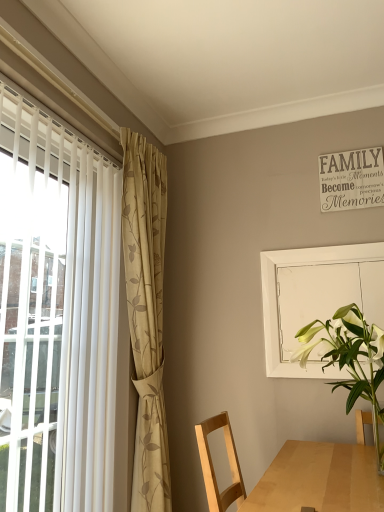
Question: From a real-world perspective, is beige floral fabric curtain at left positioned above or below white glossy vase at lower right?

Choices:
 (A) above
 (B) below

Answer: (A)

Question: Is beige floral fabric curtain at left in front of or behind white glossy vase at lower right in the image?

Choices:
 (A) behind
 (B) front

Answer: (A)

Question: Which object is positioned closest to the beige floral fabric curtain at left?

Choices:
 (A) white glossy vase at lower right
 (B) white matte screen door at upper right

Answer: (B)

Question: Which of these objects is positioned farthest from the white matte screen door at upper right?

Choices:
 (A) white glossy vase at lower right
 (B) beige floral fabric curtain at left

Answer: (B)